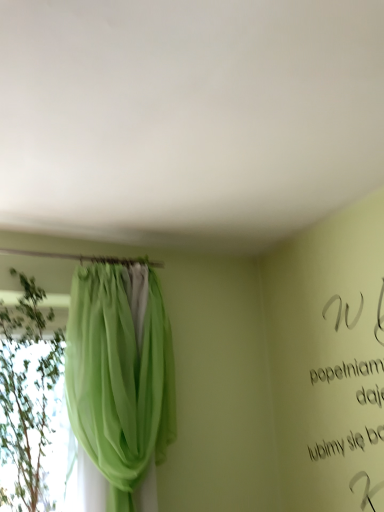
Question: Does green sheer curtain at left contain green sheer curtain at left?

Choices:
 (A) no
 (B) yes

Answer: (A)

Question: Is the depth of green sheer curtain at left greater than that of green sheer curtain at left?

Choices:
 (A) yes
 (B) no

Answer: (A)

Question: Can you see green sheer curtain at left touching green sheer curtain at left?

Choices:
 (A) no
 (B) yes

Answer: (A)

Question: Would you say green sheer curtain at left is a long distance from green sheer curtain at left?

Choices:
 (A) yes
 (B) no

Answer: (B)

Question: Can you confirm if green sheer curtain at left is wider than green sheer curtain at left?

Choices:
 (A) no
 (B) yes

Answer: (B)

Question: From the image's perspective, is green sheer curtain at left located above green sheer curtain at left?

Choices:
 (A) no
 (B) yes

Answer: (A)

Question: Could you tell me if green sheer curtain at left is turned towards green sheer curtain at left?

Choices:
 (A) yes
 (B) no

Answer: (B)

Question: Can you confirm if green sheer curtain at left is positioned to the left of green sheer curtain at left?

Choices:
 (A) no
 (B) yes

Answer: (A)

Question: From a real-world perspective, does green sheer curtain at left stand above green sheer curtain at left?

Choices:
 (A) no
 (B) yes

Answer: (B)

Question: Can we say green sheer curtain at left lies outside green sheer curtain at left?

Choices:
 (A) no
 (B) yes

Answer: (B)

Question: From the image's perspective, would you say green sheer curtain at left is shown under green sheer curtain at left?

Choices:
 (A) no
 (B) yes

Answer: (A)

Question: Does green sheer curtain at left have a smaller size compared to green sheer curtain at left?

Choices:
 (A) no
 (B) yes

Answer: (A)

Question: Is point tap(3, 348) closer or farther from the camera than point tap(119, 458)?

Choices:
 (A) farther
 (B) closer

Answer: (A)